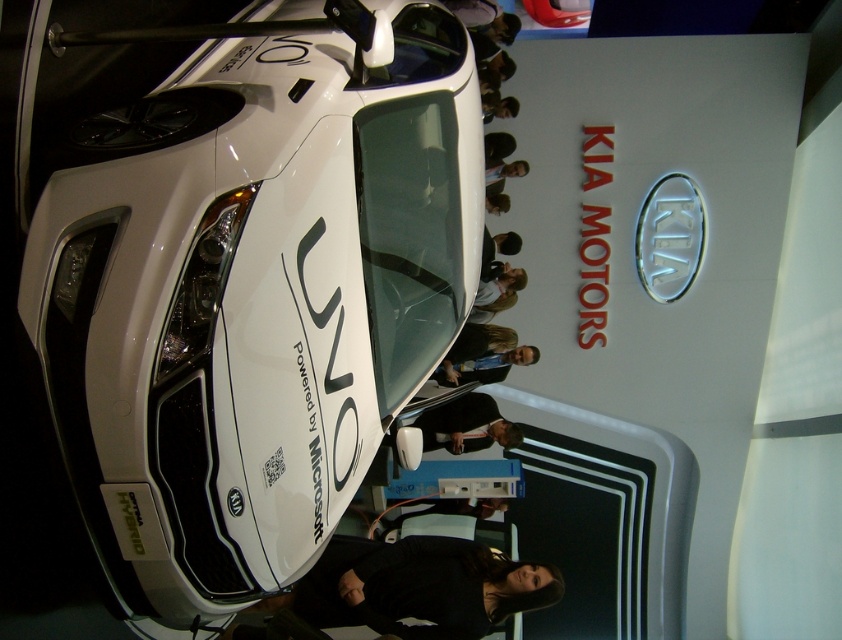
Question: Which object is the closest to the light brown leather jacket at center?

Choices:
 (A) black fabric at lower center
 (B) smooth skin face at upper center

Answer: (B)

Question: Is white glossy concept car at center smaller than dark brown hair at upper center?

Choices:
 (A) no
 (B) yes

Answer: (A)

Question: Can you confirm if black fabric at lower center is smaller than blue fabric shirt at center?

Choices:
 (A) yes
 (B) no

Answer: (B)

Question: Which point is farther to the camera?

Choices:
 (A) dark brown hair at upper center
 (B) light brown leather jacket at center
 (C) white glossy concept car at center

Answer: (B)

Question: Can you confirm if black fabric at lower center is positioned to the right of light brown leather jacket at center?

Choices:
 (A) yes
 (B) no

Answer: (B)

Question: Among these objects, which one is farthest from the camera?

Choices:
 (A) dark brown leather jacket at center
 (B) light brown hair at center
 (C) white glossy concept car at center

Answer: (B)